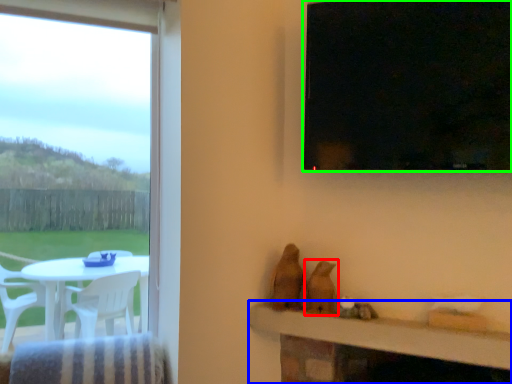
Question: Based on their relative distances, which object is farther from animal (highlighted by a red box)? Choose from table (highlighted by a blue box) and window (highlighted by a green box).

Choices:
 (A) table
 (B) window

Answer: (B)